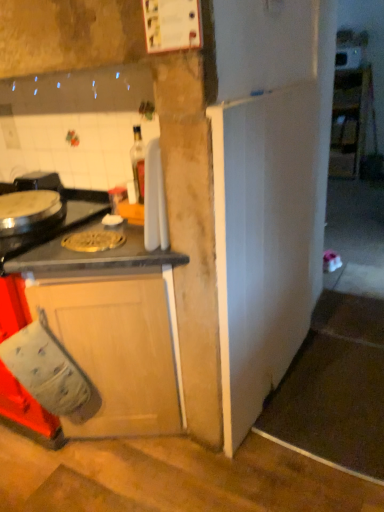
Question: Is white glossy cabinet at upper right, the first cabinetry positioned from the top, turned away from shiny metallic burner at left?

Choices:
 (A) no
 (B) yes

Answer: (A)

Question: Considering the relative sizes of white glossy cabinet at upper right, the second cabinetry from the front, and shiny metallic burner at left in the image provided, is white glossy cabinet at upper right, the second cabinetry from the front, taller than shiny metallic burner at left?

Choices:
 (A) yes
 (B) no

Answer: (A)

Question: Would you say shiny metallic burner at left is part of white glossy cabinet at upper right, marked as the second cabinetry in a left-to-right arrangement,'s contents?

Choices:
 (A) no
 (B) yes

Answer: (A)

Question: Is white glossy cabinet at upper right, the second cabinetry from the front, touching shiny metallic burner at left?

Choices:
 (A) yes
 (B) no

Answer: (B)

Question: Is white glossy cabinet at upper right, the first cabinetry positioned from the top, shorter than shiny metallic burner at left?

Choices:
 (A) yes
 (B) no

Answer: (B)

Question: Is white glossy microwave at upper right taller or shorter than gold metallic pizza pan at center?

Choices:
 (A) tall
 (B) short

Answer: (A)

Question: Is point [360, 57] closer or farther from the camera than point [115, 240]?

Choices:
 (A) farther
 (B) closer

Answer: (A)

Question: Visually, is white glossy microwave at upper right positioned to the left or to the right of gold metallic pizza pan at center?

Choices:
 (A) right
 (B) left

Answer: (A)

Question: In the image, is white glossy microwave at upper right positioned in front of or behind gold metallic pizza pan at center?

Choices:
 (A) front
 (B) behind

Answer: (B)

Question: Is gold metallic pizza pan at center inside the boundaries of white glossy cabinet at upper right, placed as the second cabinetry when sorted from bottom to top, or outside?

Choices:
 (A) inside
 (B) outside

Answer: (B)

Question: Considering the positions of gold metallic pizza pan at center and white glossy cabinet at upper right, marked as the 1th cabinetry in a right-to-left arrangement, in the image, is gold metallic pizza pan at center wider or thinner than white glossy cabinet at upper right, marked as the 1th cabinetry in a right-to-left arrangement,?

Choices:
 (A) wide
 (B) thin

Answer: (B)

Question: Relative to white glossy cabinet at upper right, marked as the second cabinetry in a left-to-right arrangement, is gold metallic pizza pan at center in front or behind?

Choices:
 (A) front
 (B) behind

Answer: (A)

Question: In terms of size, does gold metallic pizza pan at center appear bigger or smaller than white glossy cabinet at upper right, acting as the 1th cabinetry starting from the back?

Choices:
 (A) big
 (B) small

Answer: (B)

Question: From the image's perspective, is wooden cabinet at lower left, the 1th cabinetry viewed from the left, above or below gold metallic pizza pan at center?

Choices:
 (A) above
 (B) below

Answer: (B)

Question: In the image, is wooden cabinet at lower left, acting as the 2th cabinetry starting from the top, positioned in front of or behind gold metallic pizza pan at center?

Choices:
 (A) behind
 (B) front

Answer: (B)